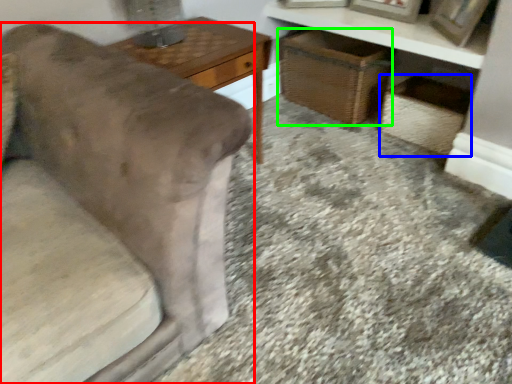
Question: Considering the real-world distances, which object is farthest from furniture (highlighted by a red box)? crate (highlighted by a blue box) or basket (highlighted by a green box)?

Choices:
 (A) crate
 (B) basket

Answer: (A)